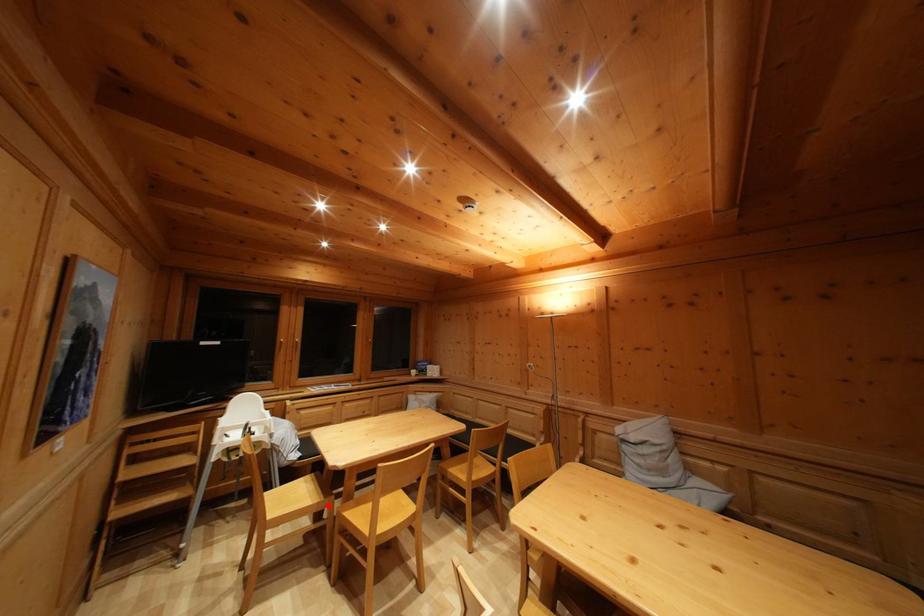
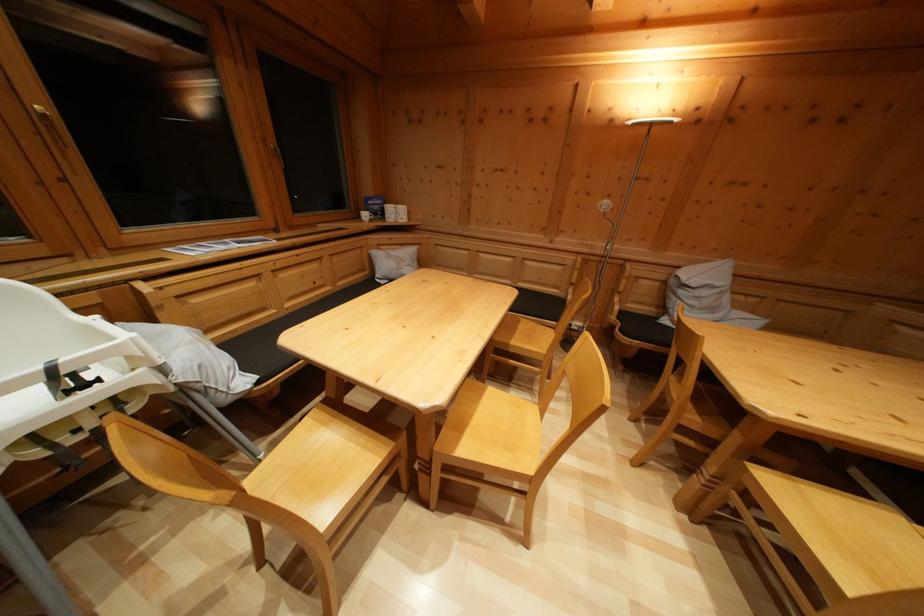
Question: A red point is marked in image1. In image2, is the corresponding 3D point closer to the camera or farther? Reply with the corresponding letter.

Choices:
 (A) The corresponding 3D point is closer.
 (B) The corresponding 3D point is farther.

Answer: (A)